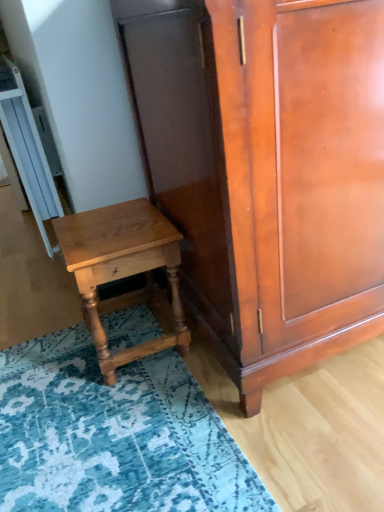
This screenshot has height=512, width=384. Find the location of `free location above light brown wood nightstand at lower left (from a real-world perspective)`. free location above light brown wood nightstand at lower left (from a real-world perspective) is located at coordinates (109, 225).